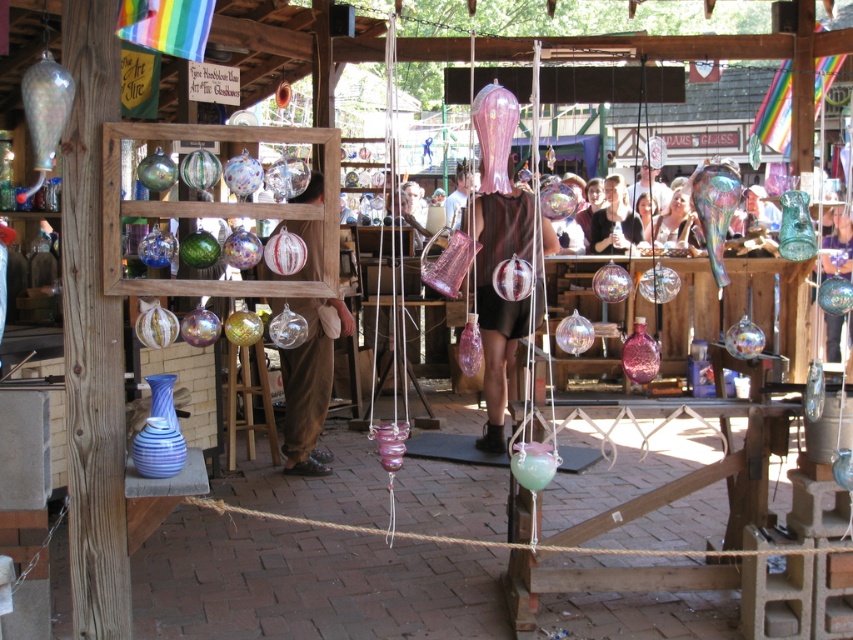
You are at the market stall and want to know if the translucent glass vase at center can fit inside the matte black dress at center. Can it?

The translucent glass vase at center is not as tall as the matte black dress at center, so it is possible that the vase could fit inside the dress depending on the dress opening and other dimensions.